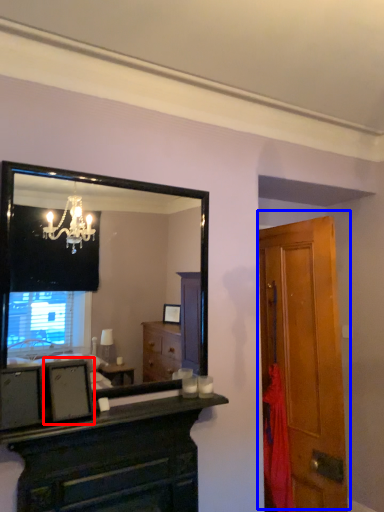
Question: Among these objects, which one is nearest to the camera, picture frame (highlighted by a red box) or door (highlighted by a blue box)?

Choices:
 (A) picture frame
 (B) door

Answer: (A)